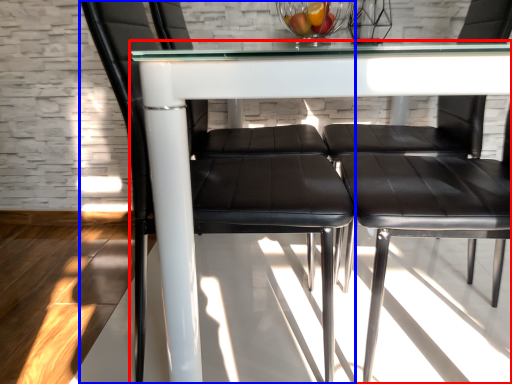
Question: Which point is closer to the camera, table (highlighted by a red box) or chair (highlighted by a blue box)?

Choices:
 (A) table
 (B) chair

Answer: (A)